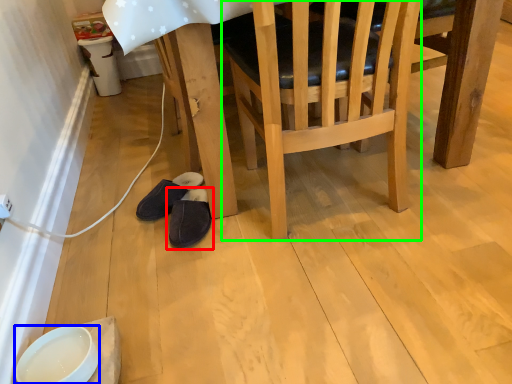
Question: Estimate the real-world distances between objects in this image. Which object is closer to footwear (highlighted by a red box), bowl (highlighted by a blue box) or chair (highlighted by a green box)?

Choices:
 (A) bowl
 (B) chair

Answer: (A)